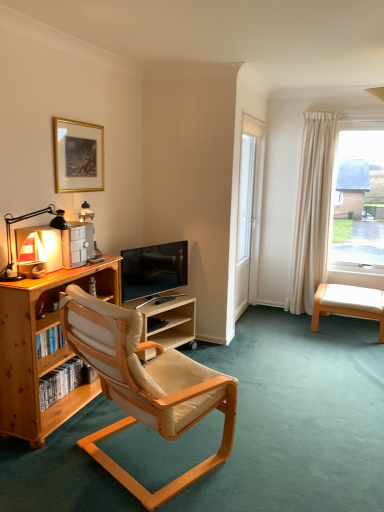
Identify the location of empty space that is to the right of light wood/woodenobject at center. Image resolution: width=384 pixels, height=512 pixels. (218, 356).